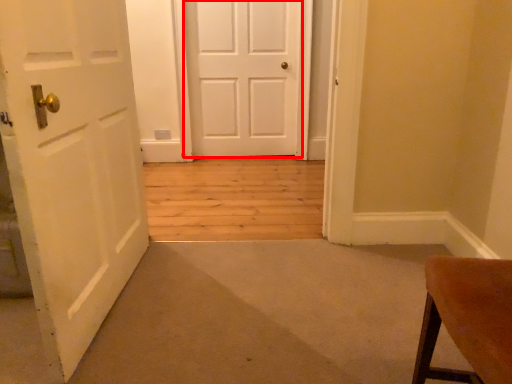
Question: Observing the image, what is the correct spatial positioning of door (annotated by the red box) in reference to door?

Choices:
 (A) left
 (B) right

Answer: (B)